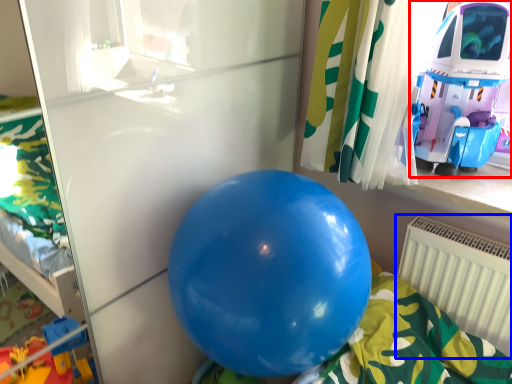
Question: Which object appears farthest to the camera in this image, toy (highlighted by a red box) or radiator (highlighted by a blue box)?

Choices:
 (A) toy
 (B) radiator

Answer: (B)